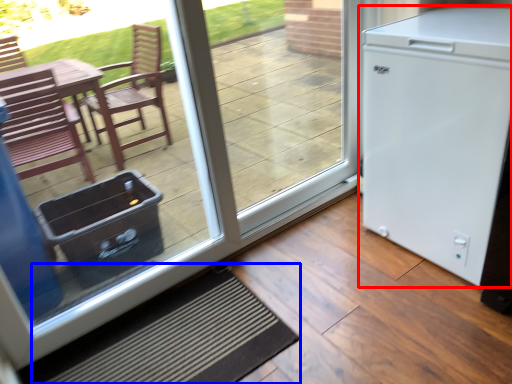
Question: Among these objects, which one is nearest to the camera, refrigerator (highlighted by a red box) or doormat (highlighted by a blue box)?

Choices:
 (A) refrigerator
 (B) doormat

Answer: (B)